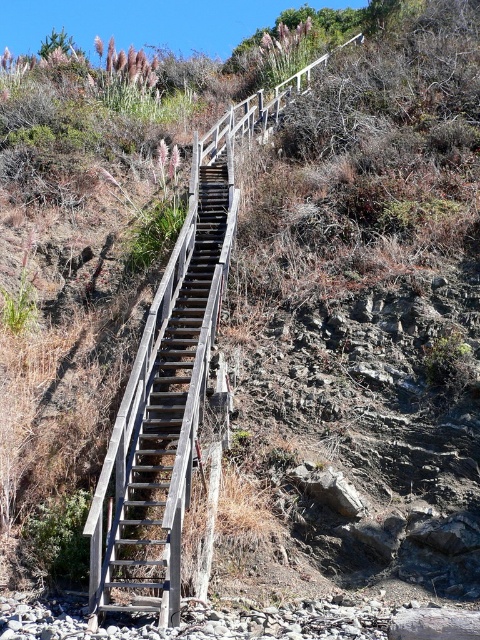
Question: Is wooden rail at upper center positioned before weathered wood stairs at center?

Choices:
 (A) no
 (B) yes

Answer: (B)

Question: Is wooden rail at upper center to the left of weathered wood stairs at center from the viewer's perspective?

Choices:
 (A) no
 (B) yes

Answer: (A)

Question: Is wooden rail at upper center below weathered wood stairs at center?

Choices:
 (A) yes
 (B) no

Answer: (B)